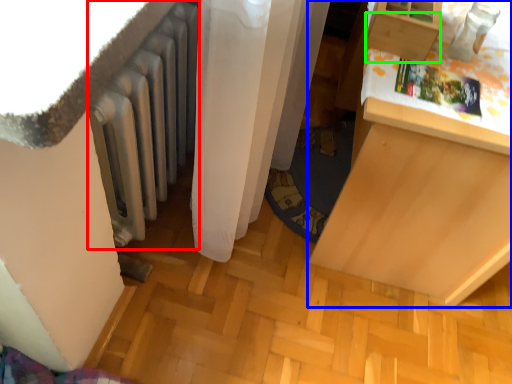
Question: Based on their relative distances, which object is nearer to radiator (highlighted by a red box)? Choose from furniture (highlighted by a blue box) and drawer (highlighted by a green box).

Choices:
 (A) furniture
 (B) drawer

Answer: (B)